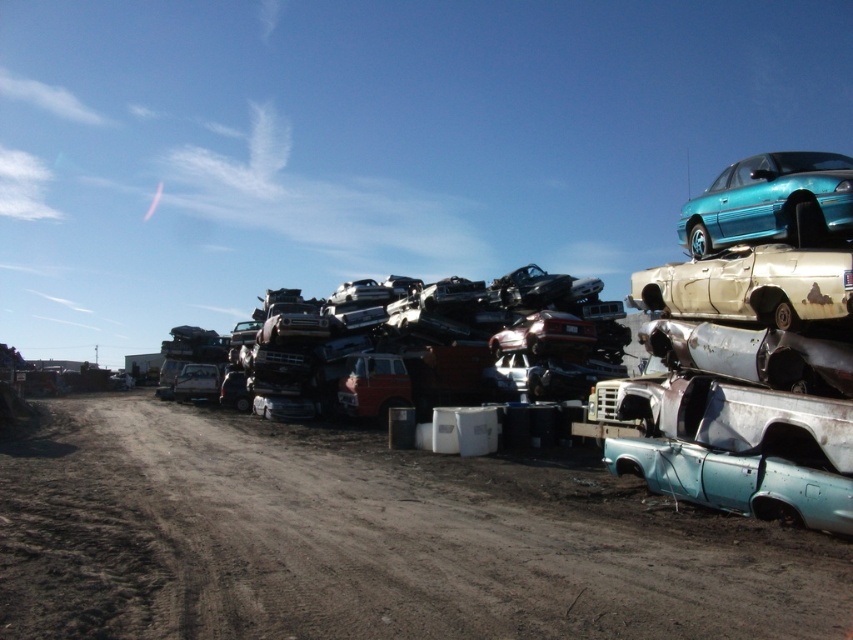
Question: Which object is farther from the camera taking this photo?

Choices:
 (A) teal glossy car at upper right
 (B) dirt track at lower left

Answer: (A)

Question: Which point is closer to the camera taking this photo?

Choices:
 (A) (805, 186)
 (B) (137, 404)

Answer: (A)

Question: In this image, where is dirt track at lower left located relative to teal glossy car at upper right?

Choices:
 (A) below
 (B) above

Answer: (A)

Question: Does dirt track at lower left appear under teal glossy car at upper right?

Choices:
 (A) no
 (B) yes

Answer: (B)

Question: Can you confirm if dirt track at lower left is positioned to the right of teal glossy car at upper right?

Choices:
 (A) no
 (B) yes

Answer: (A)

Question: Which point appears farthest from the camera in this image?

Choices:
 (A) (70, 486)
 (B) (755, 157)

Answer: (B)